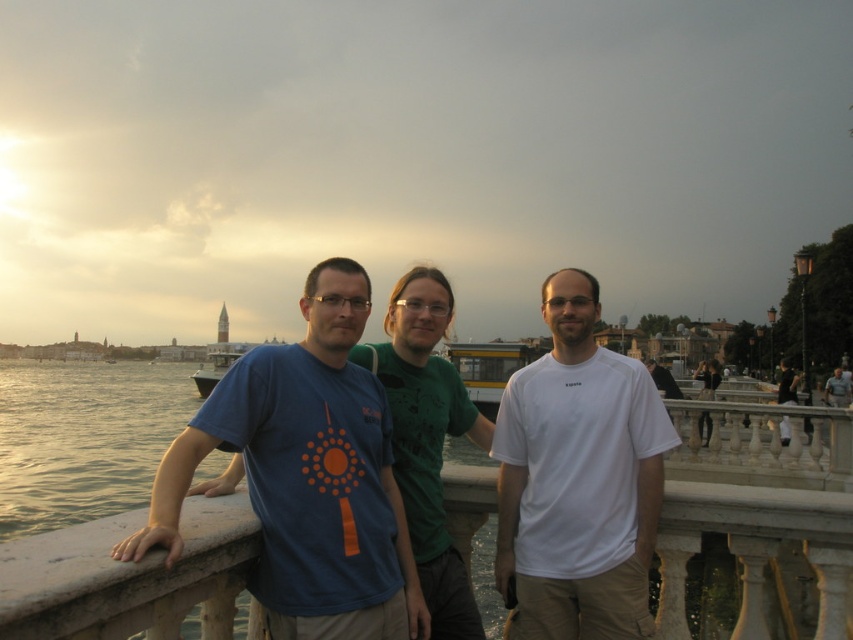
Question: Which object is farther from the camera taking this photo?

Choices:
 (A) white matte t-shirt at center
 (B) matte blue t-shirt at center

Answer: (A)

Question: Is matte blue t-shirt at center closer to camera compared to white matte t-shirt at center?

Choices:
 (A) yes
 (B) no

Answer: (A)

Question: Does matte blue t-shirt at center have a smaller size compared to white matte t-shirt at center?

Choices:
 (A) no
 (B) yes

Answer: (A)

Question: Observing the image, what is the correct spatial positioning of matte blue t-shirt at center in reference to white matte t-shirt at center?

Choices:
 (A) right
 (B) left

Answer: (B)

Question: Among these objects, which one is nearest to the camera?

Choices:
 (A) white matte t-shirt at center
 (B) matte blue t-shirt at center

Answer: (B)

Question: Which point is closer to the camera?

Choices:
 (A) (178, 509)
 (B) (619, 592)

Answer: (A)